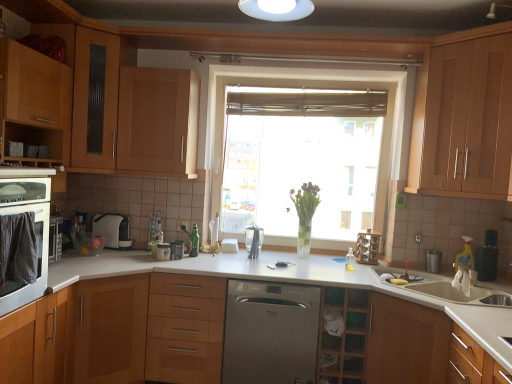
Question: Is matte wood cabinet at left, positioned as the 5th cabinetry in right-to-left order, completely or partially inside translucent glass window at center?

Choices:
 (A) no
 (B) yes

Answer: (A)

Question: From the image's perspective, is translucent glass window at center below matte wood cabinet at left, placed as the second cabinetry when sorted from left to right?

Choices:
 (A) no
 (B) yes

Answer: (A)

Question: Considering the relative positions of translucent glass window at center and matte wood cabinet at left, placed as the second cabinetry when sorted from left to right, in the image provided, is translucent glass window at center behind matte wood cabinet at left, placed as the second cabinetry when sorted from left to right,?

Choices:
 (A) yes
 (B) no

Answer: (A)

Question: Is translucent glass window at center thinner than matte wood cabinet at left, positioned as the 5th cabinetry in right-to-left order?

Choices:
 (A) yes
 (B) no

Answer: (B)

Question: Can you confirm if translucent glass window at center is wider than matte wood cabinet at left, placed as the second cabinetry when sorted from left to right?

Choices:
 (A) yes
 (B) no

Answer: (A)

Question: In the image, is yellow plastic spray bottle at right, positioned as the 1th appliance in right-to-left order, on the left side or the right side of wooden cabinet at upper right, which is the first cabinetry from right to left?

Choices:
 (A) right
 (B) left

Answer: (A)

Question: From the image's perspective, is yellow plastic spray bottle at right, the 4th appliance when ordered from left to right, positioned above or below wooden cabinet at upper right, which is the first cabinetry from right to left?

Choices:
 (A) below
 (B) above

Answer: (A)

Question: Is yellow plastic spray bottle at right, the 4th appliance when ordered from left to right, bigger or smaller than wooden cabinet at upper right, which is the first cabinetry from right to left?

Choices:
 (A) big
 (B) small

Answer: (B)

Question: Is yellow plastic spray bottle at right, positioned as the 1th appliance in right-to-left order, taller or shorter than wooden cabinet at upper right, which is the first cabinetry from right to left?

Choices:
 (A) tall
 (B) short

Answer: (B)

Question: From the image's perspective, relative to wooden drawer at center, is wooden cabinet at upper right, the sixth cabinetry from the left, above or below?

Choices:
 (A) below
 (B) above

Answer: (B)

Question: In the image, is wooden cabinet at upper right, the sixth cabinetry from the left, positioned in front of or behind wooden drawer at center?

Choices:
 (A) behind
 (B) front

Answer: (B)

Question: Looking at their shapes, would you say wooden cabinet at upper right, which is the first cabinetry from right to left, is wider or thinner than wooden drawer at center?

Choices:
 (A) wide
 (B) thin

Answer: (B)

Question: Considering the positions of wooden cabinet at upper right, the sixth cabinetry from the left, and wooden drawer at center in the image, is wooden cabinet at upper right, the sixth cabinetry from the left, taller or shorter than wooden drawer at center?

Choices:
 (A) short
 (B) tall

Answer: (B)

Question: In terms of height, does translucent glass window at center look taller or shorter compared to wooden drawer at center?

Choices:
 (A) tall
 (B) short

Answer: (A)

Question: From a real-world perspective, relative to wooden drawer at center, is translucent glass window at center vertically above or below?

Choices:
 (A) above
 (B) below

Answer: (A)